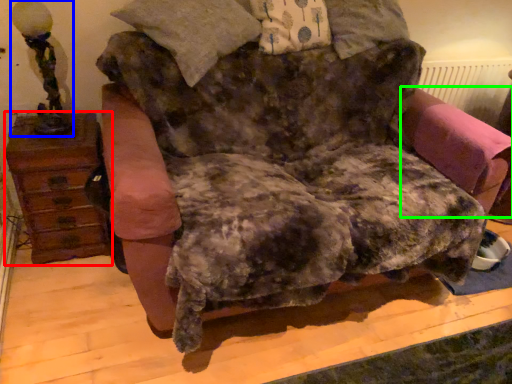
Question: Considering the real-world distances, which object is farthest from furniture (highlighted by a red box)? table lamp (highlighted by a blue box) or swivel chair (highlighted by a green box)?

Choices:
 (A) table lamp
 (B) swivel chair

Answer: (B)